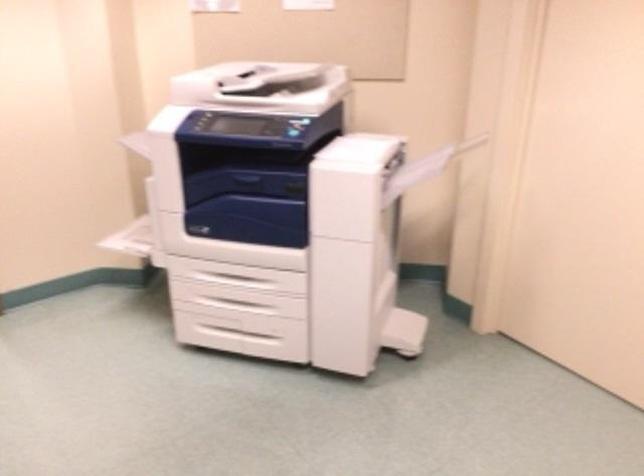
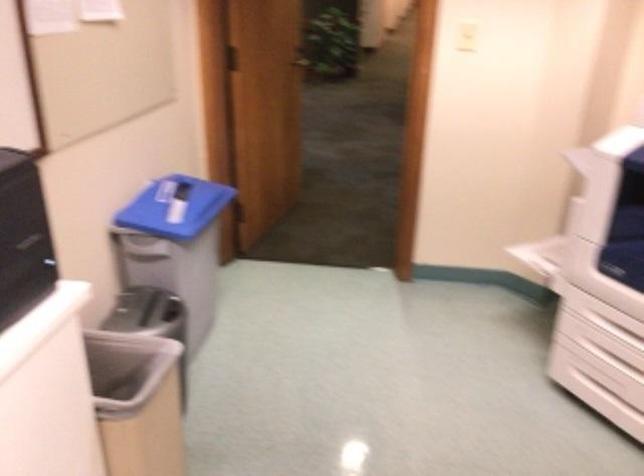
Locate, in the second image, the point that corresponds to (129,240) in the first image.

(538, 255)